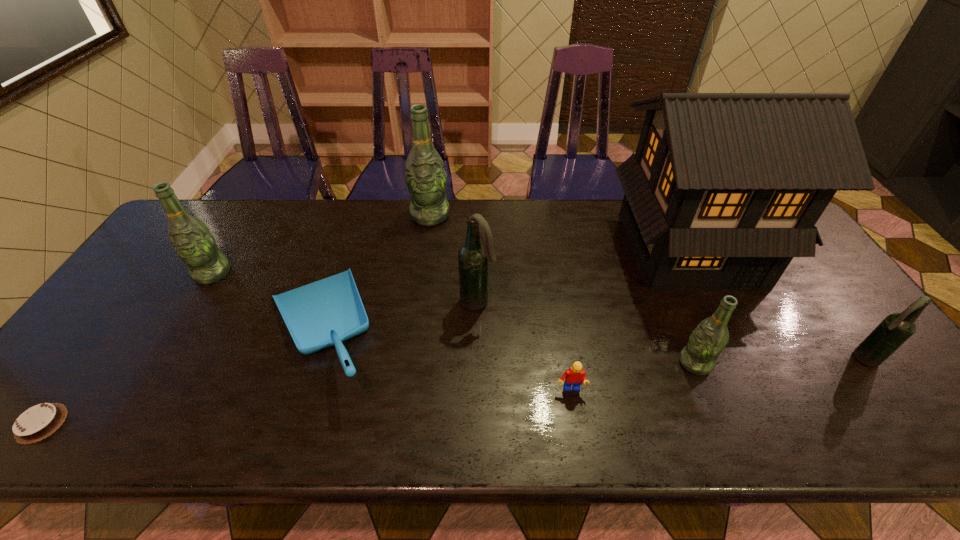
The image size is (960, 540). I want to click on vacant space that satisfies the following two spatial constraints: 1. on the surface of the rightmost beer bottle; 2. on the right side of the leftmost green beer bottle, so click(160, 359).